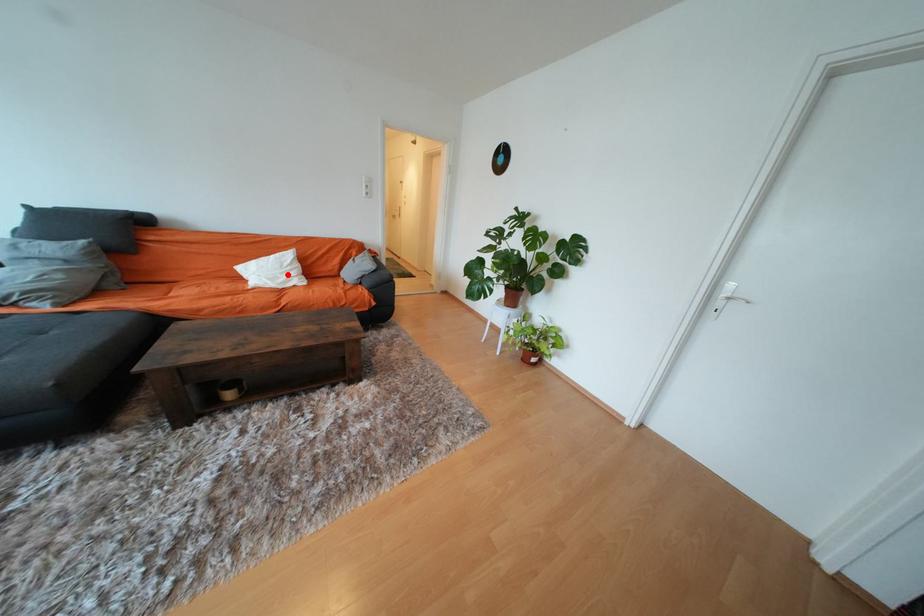
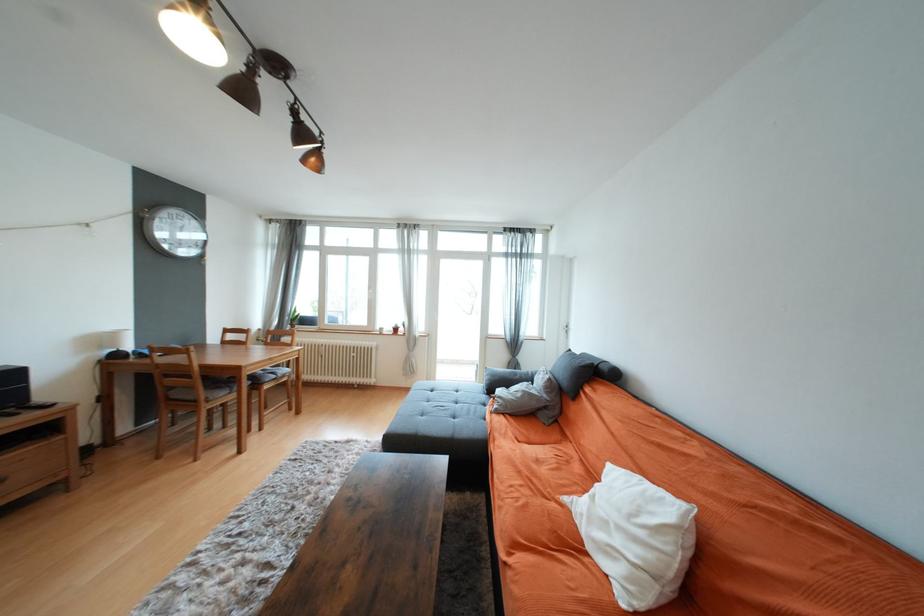
In the second image, find the point that corresponds to the highlighted location in the first image.

(625, 530)